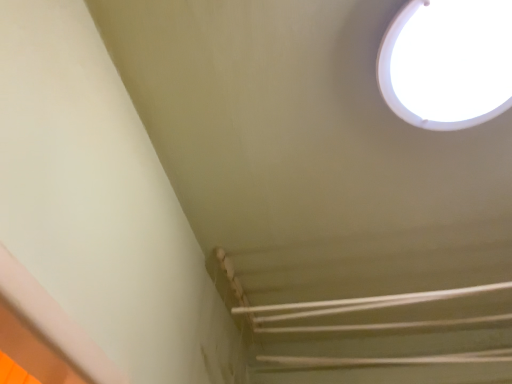
In order to face white glossy window at upper right, should I rotate leftwards or rightwards?

Rotate your view right by about 27.099°.

Image resolution: width=512 pixels, height=384 pixels. What do you see at coordinates (448, 63) in the screenshot?
I see `white glossy window at upper right` at bounding box center [448, 63].

Where is `white glossy window at upper right`? This screenshot has width=512, height=384. white glossy window at upper right is located at coordinates (448, 63).

What is the approximate height of white glossy window at upper right?

2.58 inches.

Identify the location of white glossy window at upper right. (448, 63).